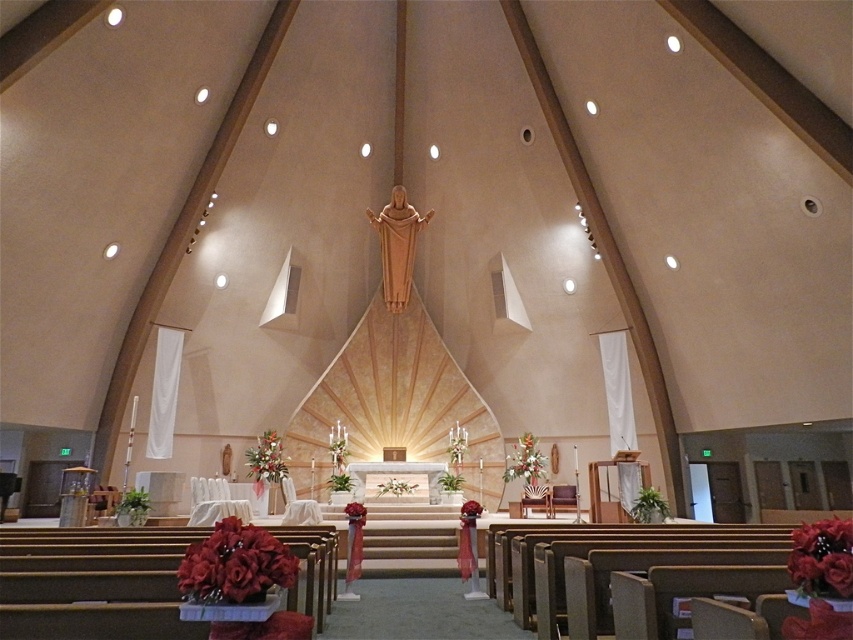
Question: Does white silk flowers at lower center have a lesser width compared to white silk flowers at center?

Choices:
 (A) no
 (B) yes

Answer: (B)

Question: Is velvety red bouquet at lower left bigger than white silk flowers at center?

Choices:
 (A) no
 (B) yes

Answer: (A)

Question: Which object is positioned closest to the silky red roses at lower right?

Choices:
 (A) white silk flowers at center
 (B) velvety red bouquet at lower left
 (C) white silk flowers at lower center

Answer: (B)

Question: Estimate the real-world distances between objects in this image. Which object is farther from the silky red roses at lower right?

Choices:
 (A) white silk flowers at lower center
 (B) white silk flowers at center

Answer: (A)

Question: Considering the real-world distances, which object is closest to the silky red roses at lower right?

Choices:
 (A) white silk flowers at center
 (B) velvety red bouquet at lower left

Answer: (B)

Question: Can you confirm if silky red roses at lower right is thinner than white silk flowers at center?

Choices:
 (A) no
 (B) yes

Answer: (B)